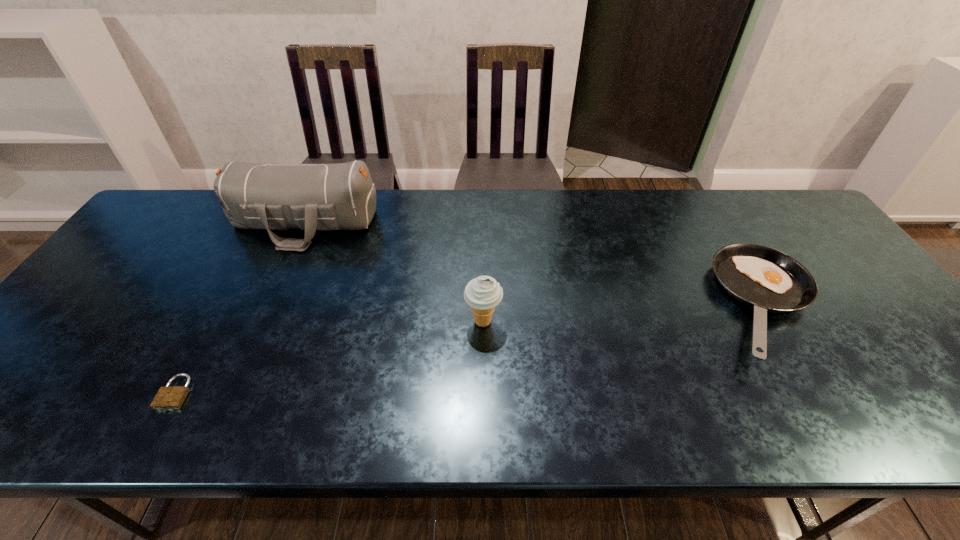
Image resolution: width=960 pixels, height=540 pixels. In order to click on duffel bag in this screenshot , I will do `click(324, 197)`.

Identify the location of the third shortest object. This screenshot has height=540, width=960. (484, 293).

Where is `the third object from left to right`? Image resolution: width=960 pixels, height=540 pixels. the third object from left to right is located at coordinates (484, 293).

Identify the location of the second shortest object. (767, 280).

At what (x,y) coordinates should I click in order to perform the action: click on the rightmost object. Please return your answer as a coordinate pair (x, y). The image size is (960, 540). Looking at the image, I should click on (767, 280).

Image resolution: width=960 pixels, height=540 pixels. Identify the location of the shortest object. (169, 397).

At what (x,y) coordinates should I click in order to perform the action: click on the nearest object. Please return your answer as a coordinate pair (x, y). Looking at the image, I should click on (169, 397).

At what (x,y) coordinates should I click in order to perform the action: click on free spot located 0.180m on the front of the duffel bag. Please return your answer as a coordinate pair (x, y). Looking at the image, I should click on (270, 300).

Where is `vacant space located on the back of the icecream`? This screenshot has height=540, width=960. vacant space located on the back of the icecream is located at coordinates (483, 265).

I want to click on vacant space positioned on the front of the frying pan, so click(828, 407).